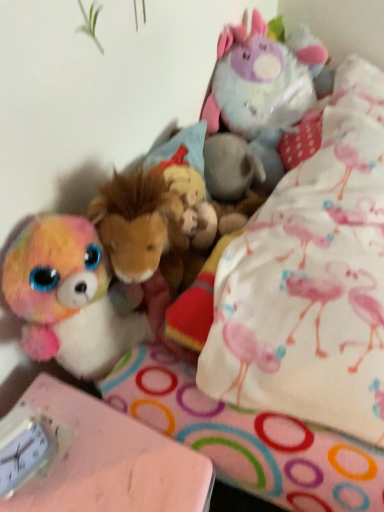
Question: Based on their positions, is pink matte table at lower left located to the left or right of fluffy plush unicorn at upper right?

Choices:
 (A) right
 (B) left

Answer: (B)

Question: From the image's perspective, is pink matte table at lower left positioned above or below fluffy plush unicorn at upper right?

Choices:
 (A) below
 (B) above

Answer: (A)

Question: Which object is the farthest from the white plastic clock at lower left?

Choices:
 (A) fluffy plush unicorn at upper right
 (B) pink matte table at lower left

Answer: (A)

Question: Considering the real-world distances, which object is closest to the white plastic clock at lower left?

Choices:
 (A) pink matte table at lower left
 (B) fluffy plush unicorn at upper right

Answer: (A)